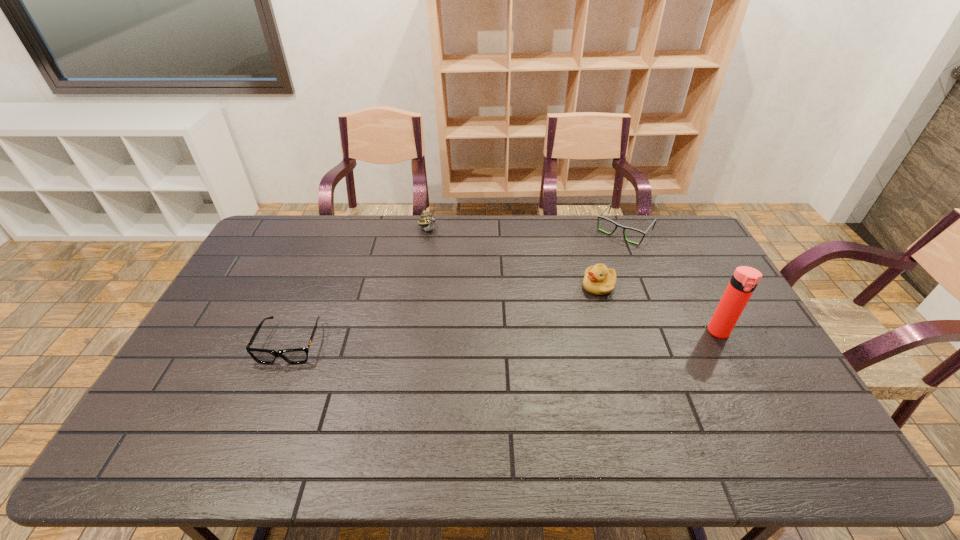
At what (x,y) coordinates should I click in order to perform the action: click on spectacles that is at the far edge. Please return your answer as a coordinate pair (x, y). This screenshot has width=960, height=540. Looking at the image, I should click on (654, 222).

Where is `thermos bottle located in the right edge section of the desktop`? The height and width of the screenshot is (540, 960). thermos bottle located in the right edge section of the desktop is located at coordinates (745, 279).

Find the location of a particular element. The width and height of the screenshot is (960, 540). spectacles that is positioned at the right edge is located at coordinates (654, 222).

The width and height of the screenshot is (960, 540). In order to click on object that is at the far right corner in this screenshot , I will do `click(654, 222)`.

Locate an element on the screen. Image resolution: width=960 pixels, height=540 pixels. vacant space at the far edge is located at coordinates (536, 237).

Locate an element on the screen. vacant space at the near edge is located at coordinates coord(413,399).

The height and width of the screenshot is (540, 960). Identify the location of free space at the left edge of the desktop. (272, 282).

At what (x,y) coordinates should I click in order to perform the action: click on vacant space at the right edge of the desktop. Please return your answer as a coordinate pair (x, y). Image resolution: width=960 pixels, height=540 pixels. Looking at the image, I should click on (709, 296).

In order to click on blank space at the far left corner of the desktop in this screenshot , I will do `click(297, 232)`.

At what (x,y) coordinates should I click in order to perform the action: click on free space at the near left corner. Please return your answer as a coordinate pair (x, y). This screenshot has height=540, width=960. Looking at the image, I should click on (175, 397).